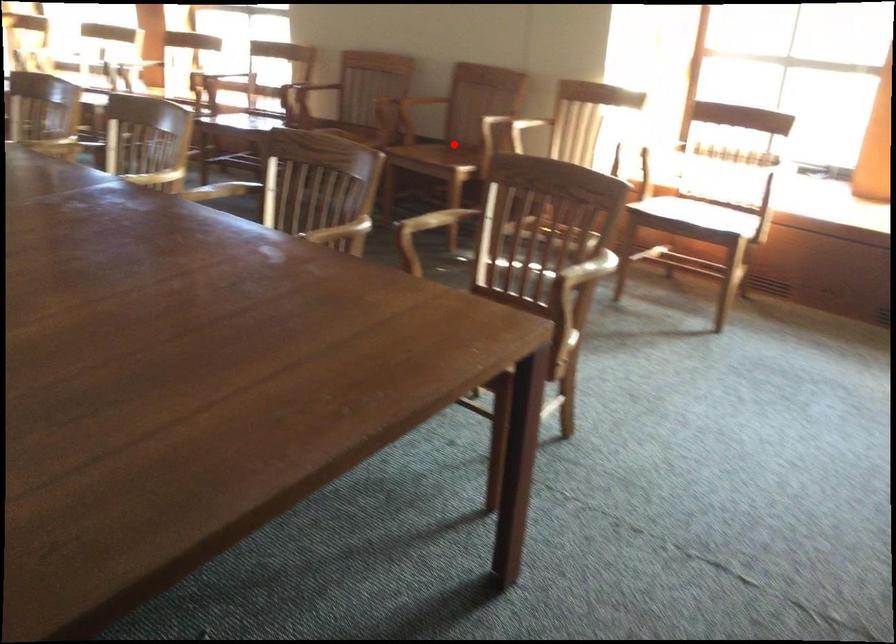
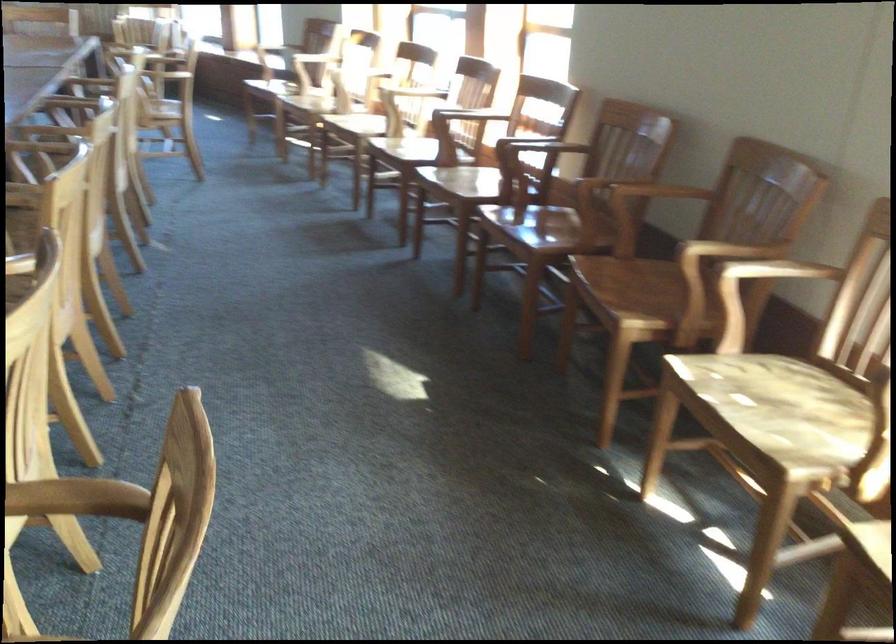
In the second image, find the point that corresponds to the highlighted location in the first image.

(650, 283)